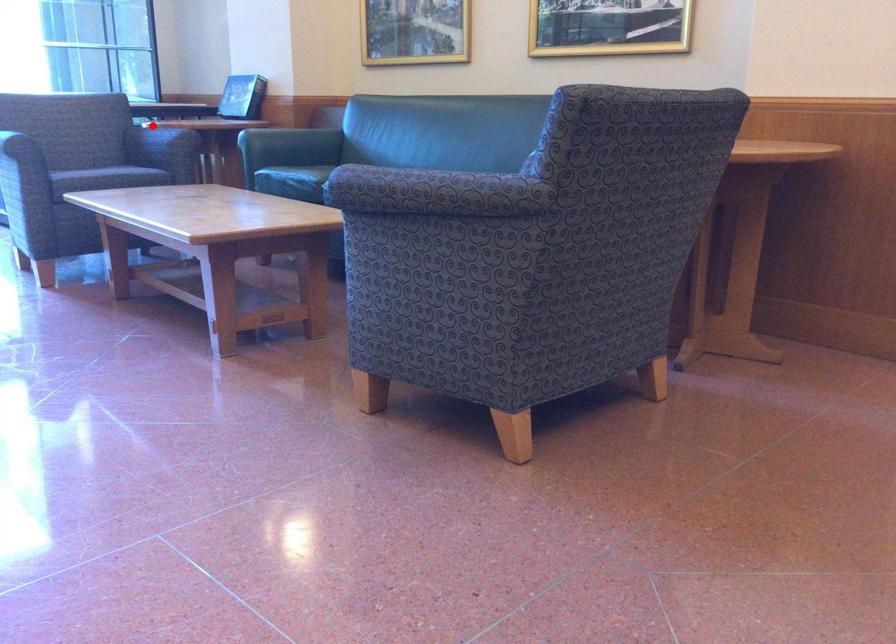
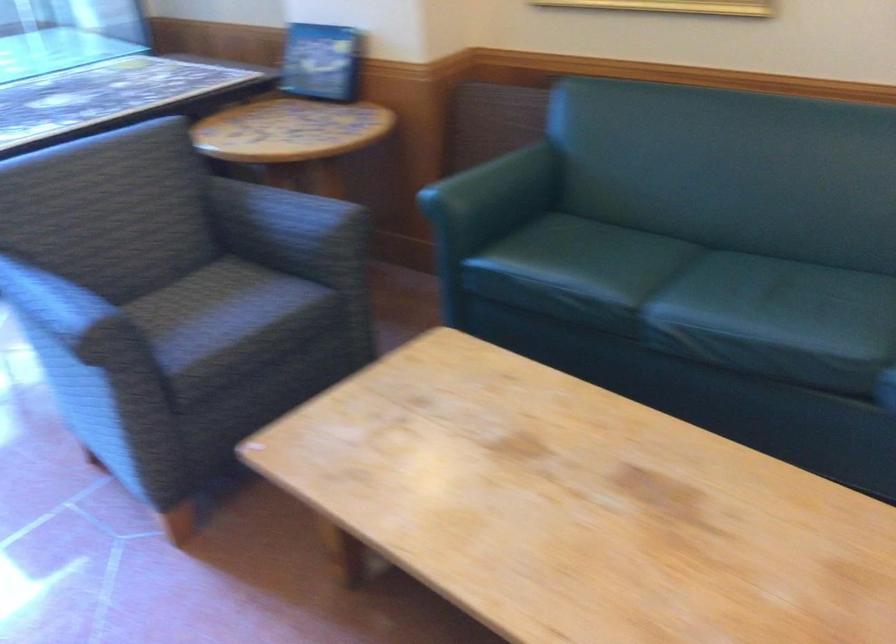
Question: I am providing you with two images of the same scene from different viewpoints. In image1, a red point is highlighted. Considering the same 3D point in image2, which of the following is correct?

Choices:
 (A) It is closer
 (B) It is farther

Answer: (A)